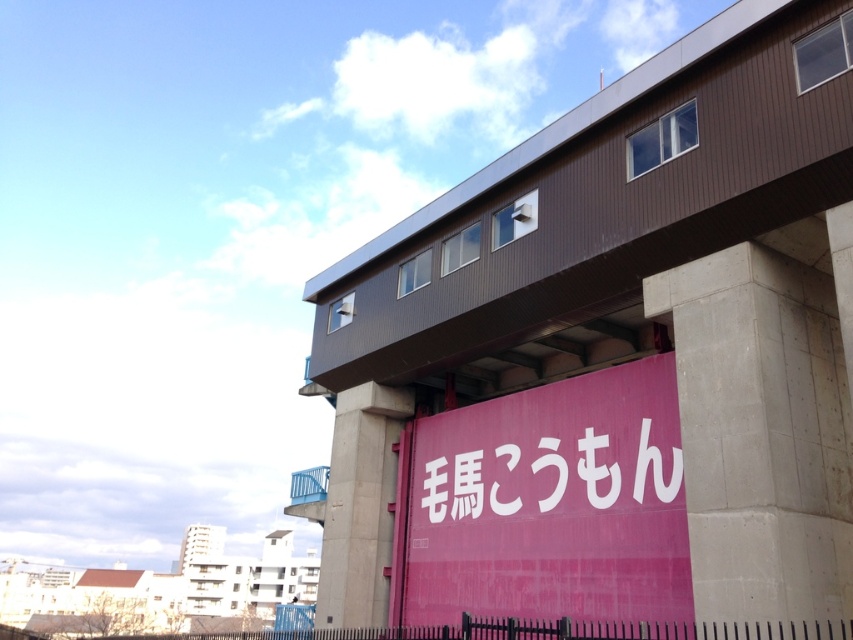
Is white matte sign at center wider than concrete at center?

No, white matte sign at center is not wider than concrete at center.

The image size is (853, 640). What do you see at coordinates (550, 474) in the screenshot? I see `white matte sign at center` at bounding box center [550, 474].

In order to click on white matte sign at center in this screenshot , I will do `click(550, 474)`.

Between concrete at right and white matte sign at center, which one appears on the right side from the viewer's perspective?

concrete at right is more to the right.

Who is taller, concrete at right or white matte sign at center?

Standing taller between the two is concrete at right.

Who is more forward, [746,288] or [495,465]?

Positioned in front is point [746,288].

Locate an element on the screen. The image size is (853, 640). concrete at right is located at coordinates (761, 433).

Between point (637, 218) and point (735, 536), which one is positioned behind?

Point (637, 218)

Does brown wood overpass at upper center appear under concrete at right?

No, brown wood overpass at upper center is not below concrete at right.

Is point (409, 348) closer to camera compared to point (786, 352)?

No, it is not.

What are the coordinates of `brown wood overpass at upper center` in the screenshot? It's located at (601, 202).